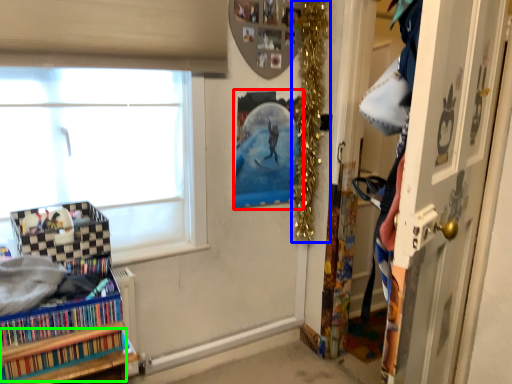
Question: Which is farther away from picture frame (highlighted by a red box)? christmas decoration (highlighted by a blue box) or book (highlighted by a green box)?

Choices:
 (A) christmas decoration
 (B) book

Answer: (B)